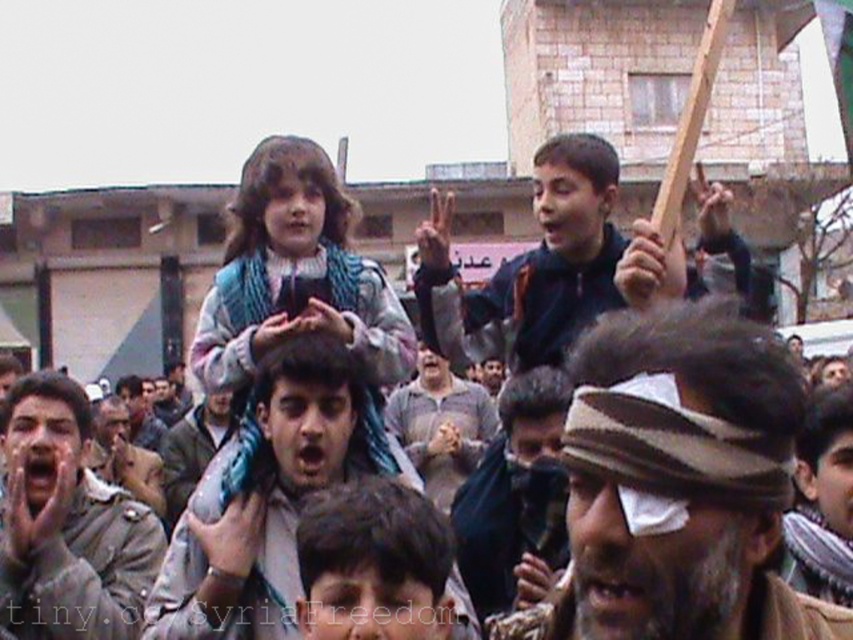
The height and width of the screenshot is (640, 853). Find the location of `blue fabric shirt at center`. blue fabric shirt at center is located at coordinates (263, 499).

The image size is (853, 640). Identify the location of blue fabric shirt at center. (263, 499).

Identify the location of blue fabric shirt at center. This screenshot has width=853, height=640. (263, 499).

Which is more to the left, striped fabric headband at center or blue knitted scarf at center?

From the viewer's perspective, blue knitted scarf at center appears more on the left side.

Is striped fabric headband at center above blue knitted scarf at center?

No, striped fabric headband at center is not above blue knitted scarf at center.

I want to click on striped fabric headband at center, so click(x=677, y=483).

Can you confirm if dark brown hair at center is wider than gray wool scarf at center?

Incorrect, dark brown hair at center's width does not surpass gray wool scarf at center's.

Does point (390, 605) come closer to viewer compared to point (173, 483)?

Yes, it is.

In order to click on dark brown hair at center in this screenshot , I will do `click(373, 563)`.